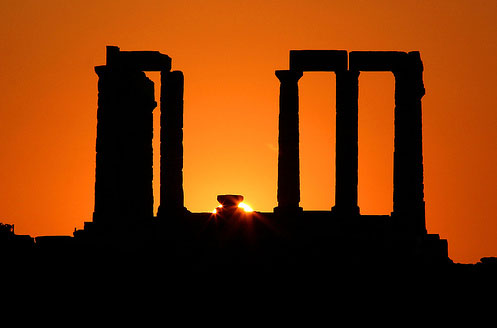
You are a GUI agent. You are given a task and a screenshot of the screen. Output one action in this format:
    pyautogui.click(x=<x>, y=<y>)
    Task: Click on the altar
    This screenshot has height=328, width=497.
    Given the screenshot: What is the action you would take?
    coord(229,197)